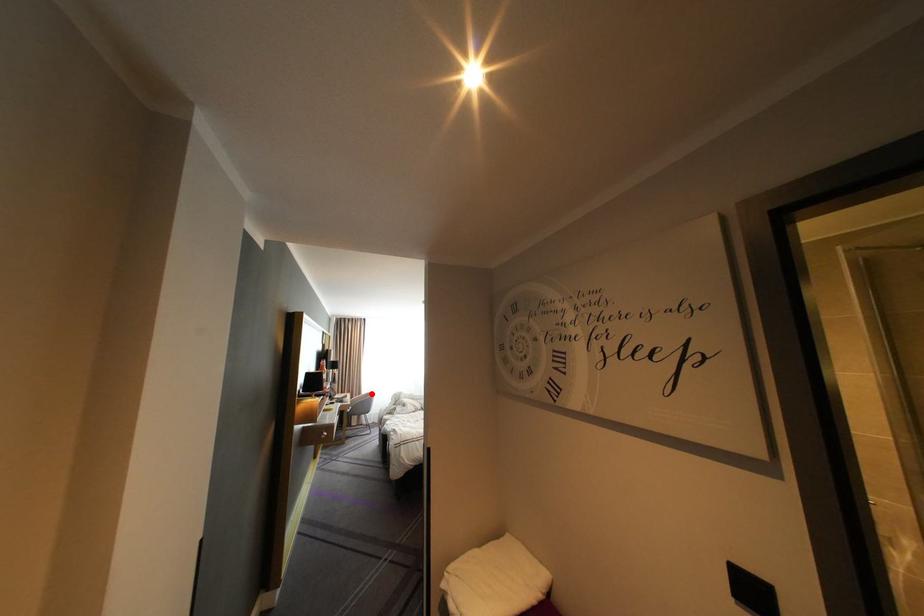
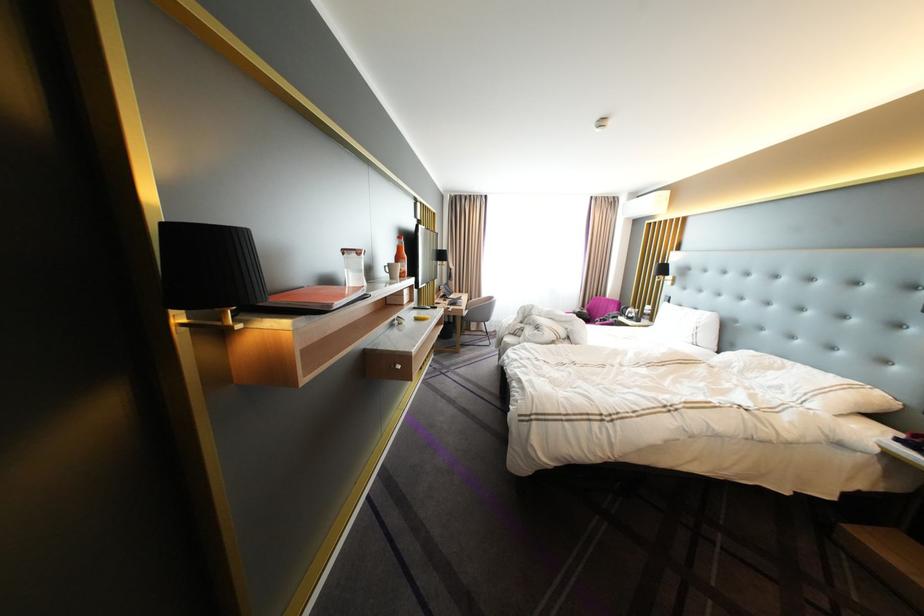
Question: I am providing you with two images of the same scene from different viewpoints. A red point is shown in image1. For the corresponding object point in image2, is it positioned nearer or farther from the camera?

Choices:
 (A) Nearer
 (B) Farther

Answer: (A)